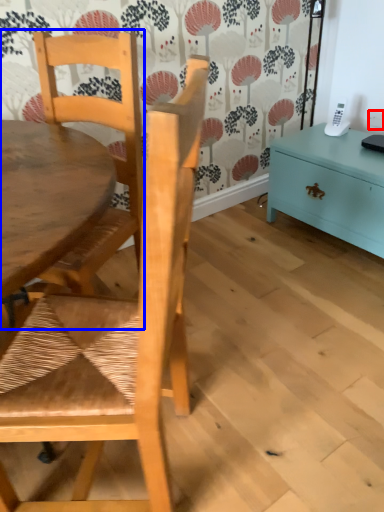
Question: Which of the following is the closest to the observer, power outlet (highlighted by a red box) or chair (highlighted by a blue box)?

Choices:
 (A) power outlet
 (B) chair

Answer: (B)